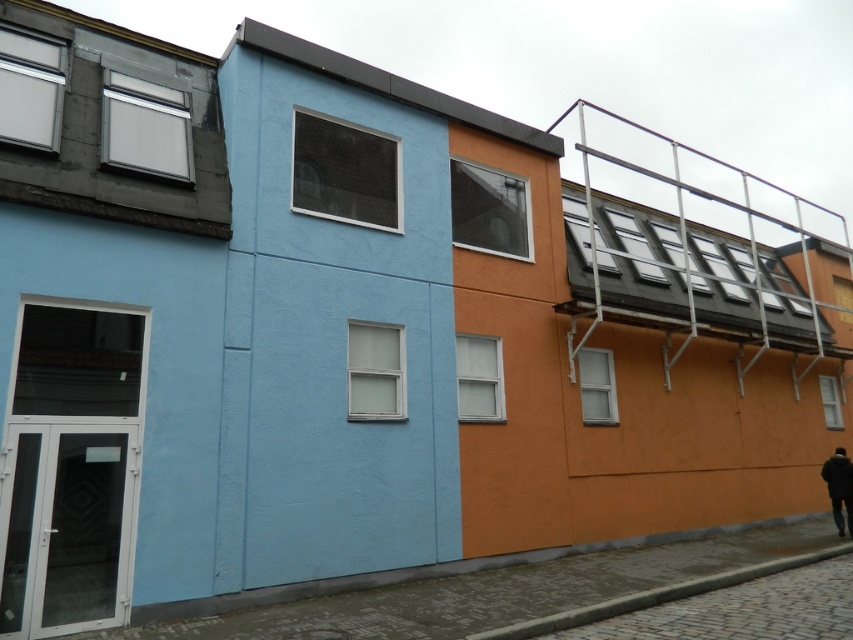
You are a delivery person trying to reach the entrance of the building. You see a metallic silver rail at upper right and a dark blue jacket at lower right. Which object is closer to the entrance?

The dark blue jacket at lower right is closer to the entrance because it is positioned lower than the metallic silver rail at upper right, which is higher up.

You are a delivery person trying to carry a dark blue jacket at lower right up to the second floor. There is a metallic silver rail at upper right near the entrance. Can you pass the jacket through the rail without removing it from your path?

The metallic silver rail at upper right might be wider than the dark blue jacket at lower right, so there is a possibility that the jacket can pass through without obstruction. However, since the exact width difference isn not specified, it is recommended to check the dimensions before attempting to pass.

You are standing at the base of the two story building and want to know which of the two points, point (x=732, y=278) or point (x=840, y=474), is closer to you. Which one is closer?

Point (x=840, y=474) is closer to you because it is less further to the camera than point (x=732, y=278).